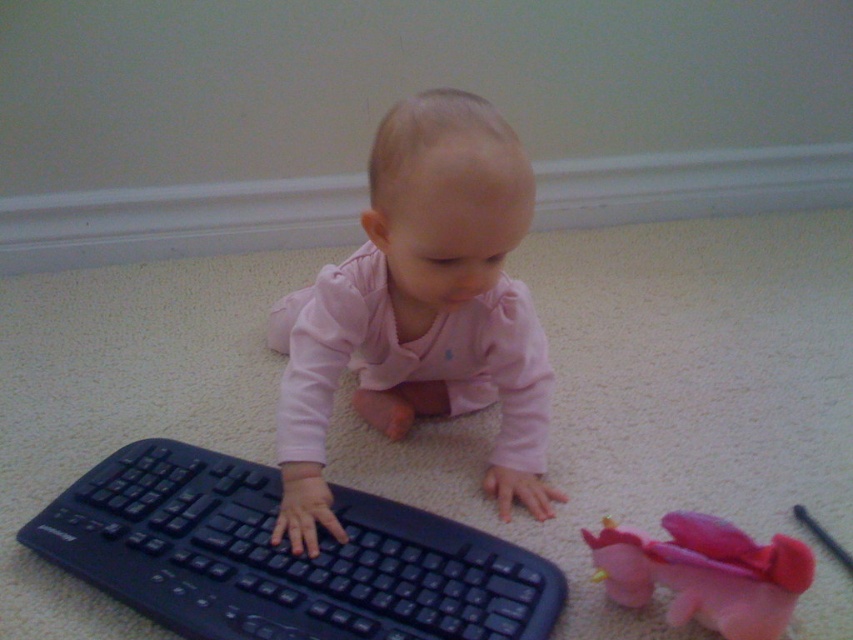
Does point (199, 609) lie in front of point (659, 576)?

No, (199, 609) is further to viewer.

Can you confirm if black plastic keyboard at center is positioned below pink fabric dragon at lower right?

Incorrect, black plastic keyboard at center is not positioned below pink fabric dragon at lower right.

Does point (264, 570) come closer to viewer compared to point (619, 561)?

No, it is behind (619, 561).

At what (x,y) coordinates should I click in order to perform the action: click on black plastic keyboard at center. Please return your answer as a coordinate pair (x, y). This screenshot has height=640, width=853. Looking at the image, I should click on (283, 556).

Which is above, pink matte baby at center or pink fabric dragon at lower right?

pink matte baby at center

Between pink matte baby at center and pink fabric dragon at lower right, which one has more height?

pink matte baby at center

You are a GUI agent. You are given a task and a screenshot of the screen. Output one action in this format:
    pyautogui.click(x=<x>, y=<y>)
    Task: Click on the pink matte baby at center
    
    Given the screenshot: What is the action you would take?
    pyautogui.click(x=421, y=310)

Locate an element on the screen. This screenshot has width=853, height=640. pink matte baby at center is located at coordinates (421, 310).

Who is more forward, (500, 294) or (462, 552)?

Point (462, 552)

Who is shorter, pink matte baby at center or black plastic keyboard at center?

black plastic keyboard at center is shorter.

Is point (486, 131) less distant than point (100, 580)?

Yes, it is in front of point (100, 580).

This screenshot has height=640, width=853. Find the location of `pink matte baby at center`. pink matte baby at center is located at coordinates (421, 310).